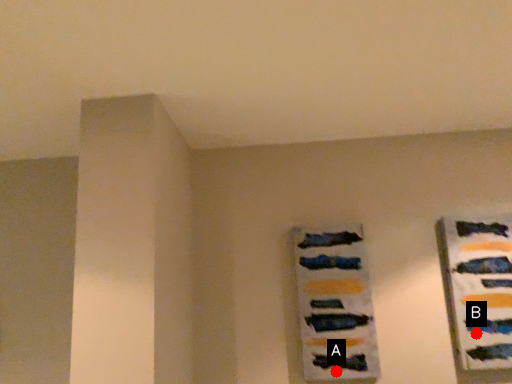
Question: Two points are circled on the image, labeled by A and B beside each circle. Among these points, which one is nearest to the camera?

Choices:
 (A) A is closer
 (B) B is closer

Answer: (A)